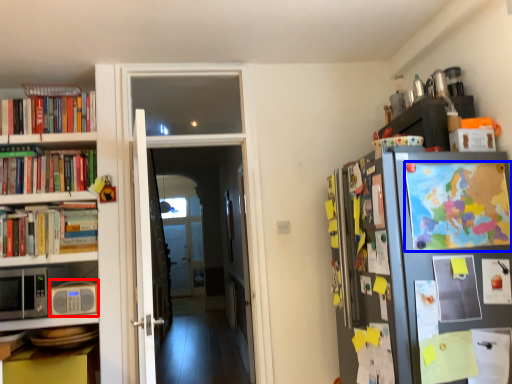
Question: Which point is closer to the camera, appliance (highlighted by a red box) or book (highlighted by a blue box)?

Choices:
 (A) appliance
 (B) book

Answer: (B)